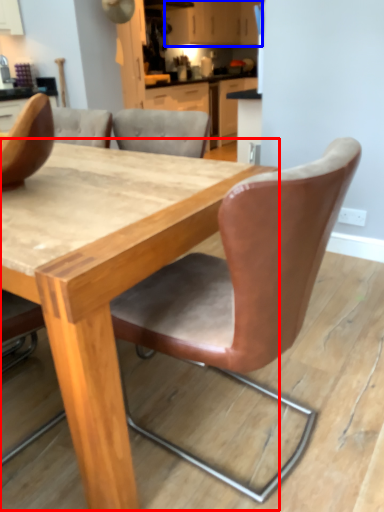
Question: Which object appears farthest to the camera in this image, table (highlighted by a red box) or cabinetry (highlighted by a blue box)?

Choices:
 (A) table
 (B) cabinetry

Answer: (B)